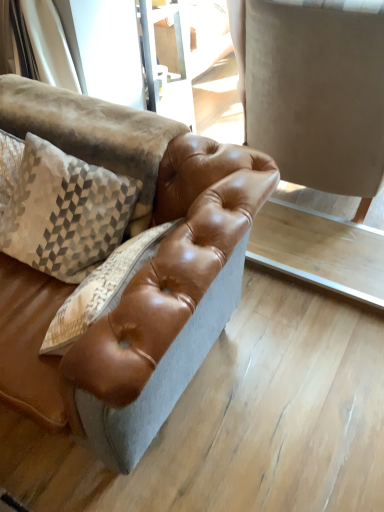
Question: From the image's perspective, relative to brown leather swivel chair at center, is light brown leather table at center above or below?

Choices:
 (A) below
 (B) above

Answer: (A)

Question: Considering their positions, is light brown leather table at center located in front of or behind brown leather swivel chair at center?

Choices:
 (A) front
 (B) behind

Answer: (B)

Question: Considering the real-world distances, which object is farthest from the brown leather swivel chair at center?

Choices:
 (A) light brown leather table at center
 (B) textured beige pillow at upper left

Answer: (B)

Question: Estimate the real-world distances between objects in this image. Which object is closer to the brown leather swivel chair at center?

Choices:
 (A) light brown leather table at center
 (B) textured beige pillow at upper left

Answer: (A)